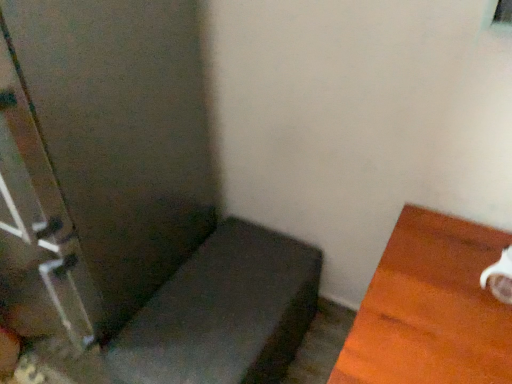
Locate an element on the screen. This screenshot has height=384, width=512. vacant area on top of matte gray cushion at lower left, which is counted as the 1th furniture, starting from the left (from a real-world perspective) is located at coordinates (220, 303).